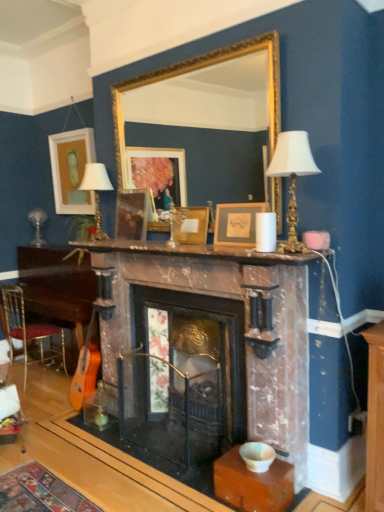
Question: Can you confirm if gold/gilded mirror at upper center is positioned to the right of white matte picture frame at upper left, the 4th picture frame when ordered from right to left?

Choices:
 (A) no
 (B) yes

Answer: (B)

Question: Considering the relative sizes of gold/gilded mirror at upper center and white matte picture frame at upper left, which is the first picture frame from left to right, in the image provided, is gold/gilded mirror at upper center wider than white matte picture frame at upper left, which is the first picture frame from left to right,?

Choices:
 (A) yes
 (B) no

Answer: (B)

Question: From the image's perspective, is gold/gilded mirror at upper center below white matte picture frame at upper left, the 4th picture frame when ordered from right to left?

Choices:
 (A) yes
 (B) no

Answer: (A)

Question: Is gold/gilded mirror at upper center positioned behind white matte picture frame at upper left, which is the first picture frame from left to right?

Choices:
 (A) no
 (B) yes

Answer: (A)

Question: Considering the relative sizes of gold/gilded mirror at upper center and white matte picture frame at upper left, the 4th picture frame when ordered from right to left, in the image provided, is gold/gilded mirror at upper center shorter than white matte picture frame at upper left, the 4th picture frame when ordered from right to left,?

Choices:
 (A) yes
 (B) no

Answer: (A)

Question: Could you tell me if gold/gilded mirror at upper center is turned towards white matte picture frame at upper left, placed as the fourth picture frame when sorted from front to back?

Choices:
 (A) no
 (B) yes

Answer: (A)

Question: From the image's perspective, is marble mantel at center under wooden picture frame at center, which is the 2th picture frame from left to right?

Choices:
 (A) yes
 (B) no

Answer: (A)

Question: Is marble mantel at center further to camera compared to wooden picture frame at center, the 3th picture frame viewed from the right?

Choices:
 (A) yes
 (B) no

Answer: (B)

Question: Can you confirm if marble mantel at center is smaller than wooden picture frame at center, which is the second picture frame in back-to-front order?

Choices:
 (A) no
 (B) yes

Answer: (A)

Question: Can you confirm if marble mantel at center is positioned to the right of wooden picture frame at center, which is the 2th picture frame from left to right?

Choices:
 (A) no
 (B) yes

Answer: (B)

Question: From a real-world perspective, does marble mantel at center stand above wooden picture frame at center, which is the second picture frame in back-to-front order?

Choices:
 (A) no
 (B) yes

Answer: (A)

Question: From a real-world perspective, is marble mantel at center physically below wooden picture frame at center, which is the second picture frame in back-to-front order?

Choices:
 (A) yes
 (B) no

Answer: (A)

Question: Considering the relative positions of wooden picture frame at center, which ranks as the 2th picture frame in front-to-back order, and metallic gold chair at lower left in the image provided, is wooden picture frame at center, which ranks as the 2th picture frame in front-to-back order, to the right of metallic gold chair at lower left from the viewer's perspective?

Choices:
 (A) yes
 (B) no

Answer: (A)